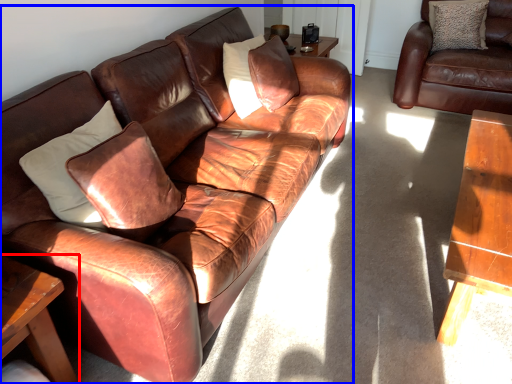
Question: Which of the following is the closest to the observer, table (highlighted by a red box) or studio couch (highlighted by a blue box)?

Choices:
 (A) table
 (B) studio couch

Answer: (B)